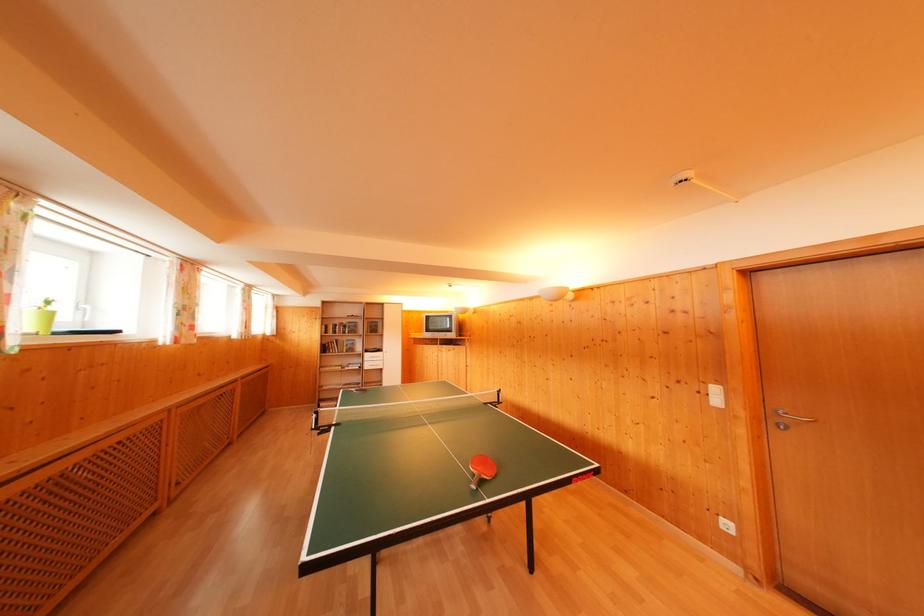
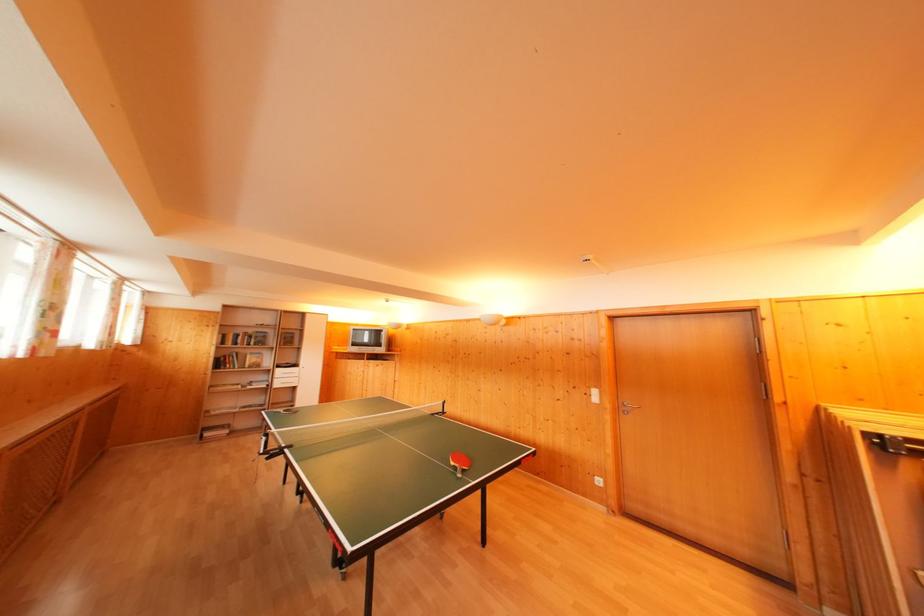
Question: Based on the continuous images, in which direction is the camera rotating? Reply with the corresponding letter.

Choices:
 (A) Left
 (B) Right
 (C) Up
 (D) Down

Answer: (B)